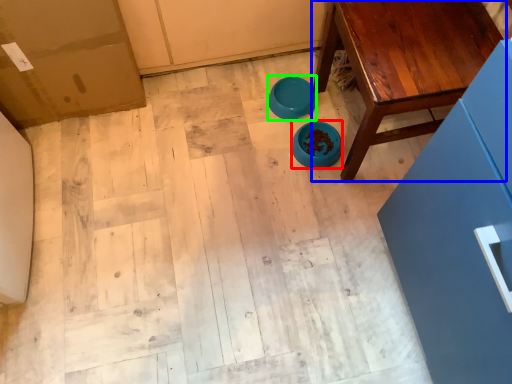
Question: Which object is the farthest from bowl (highlighted by a red box)? Choose among these: table (highlighted by a blue box) or bowl (highlighted by a green box).

Choices:
 (A) table
 (B) bowl

Answer: (A)